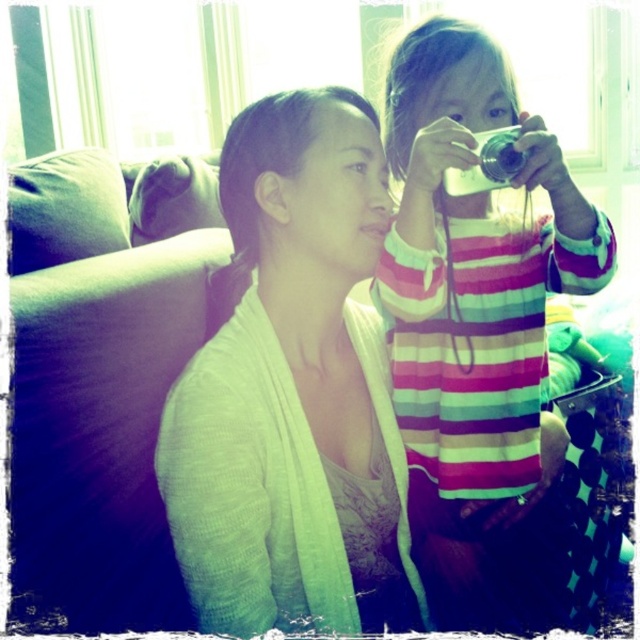
Question: Where is green textured sweater at center located in relation to striped fabric shirt at upper right in the image?

Choices:
 (A) left
 (B) right

Answer: (A)

Question: Which object appears farthest from the camera in this image?

Choices:
 (A) green textured sweater at center
 (B) striped fabric shirt at upper right

Answer: (B)

Question: Does green textured sweater at center appear over striped fabric shirt at upper right?

Choices:
 (A) no
 (B) yes

Answer: (A)

Question: Is green textured sweater at center positioned in front of striped fabric shirt at upper right?

Choices:
 (A) yes
 (B) no

Answer: (A)

Question: Which of the following is the closest to the observer?

Choices:
 (A) green textured sweater at center
 (B) striped fabric shirt at upper right

Answer: (A)

Question: Among these objects, which one is nearest to the camera?

Choices:
 (A) striped fabric shirt at upper right
 (B) green textured sweater at center

Answer: (B)